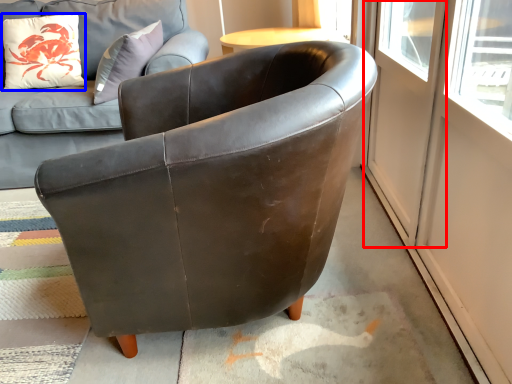
Question: Which object is closer to the camera taking this photo, screen door (highlighted by a red box) or pillow (highlighted by a blue box)?

Choices:
 (A) screen door
 (B) pillow

Answer: (A)